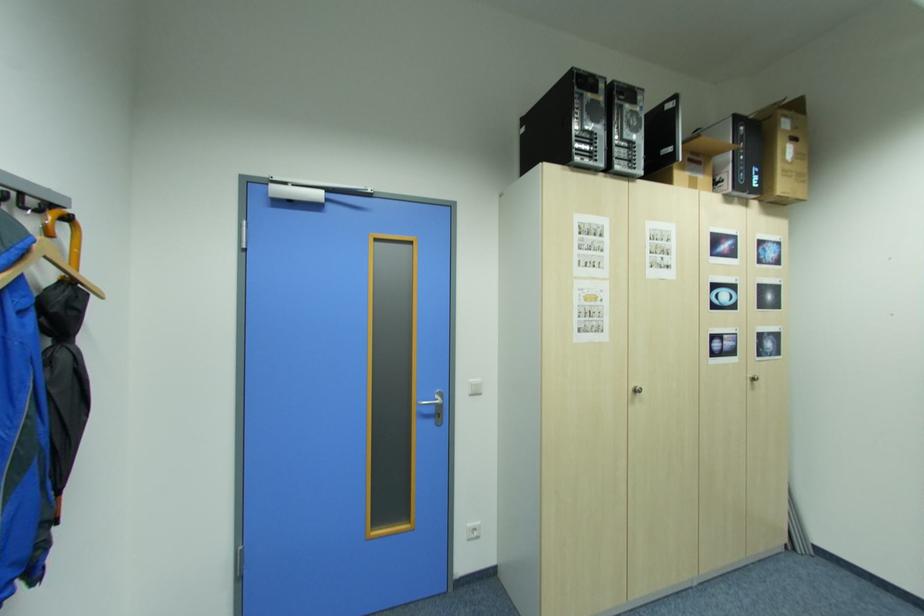
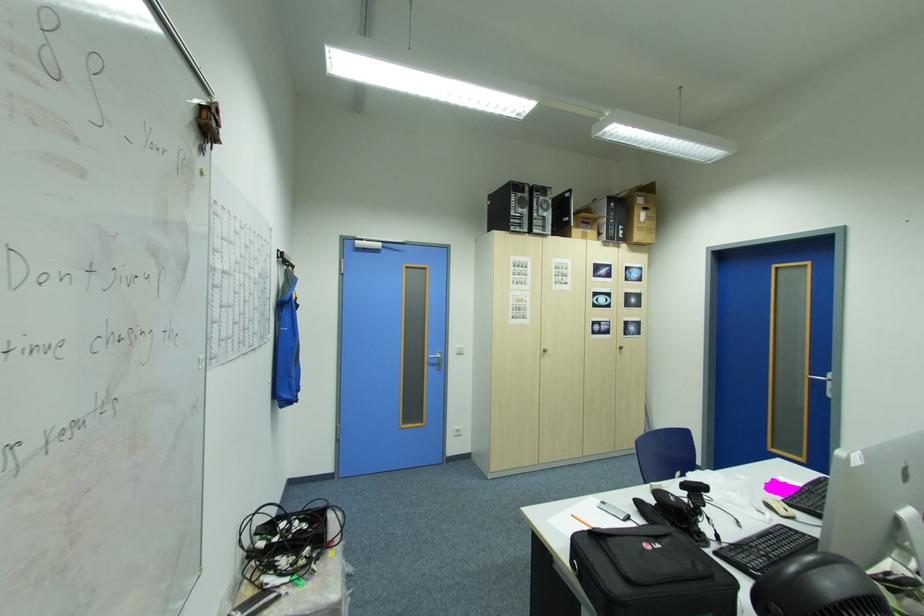
Question: In a continuous first-person perspective shot, in which direction is the camera moving?

Choices:
 (A) Left
 (B) Right
 (C) Forward
 (D) Backward

Answer: (D)